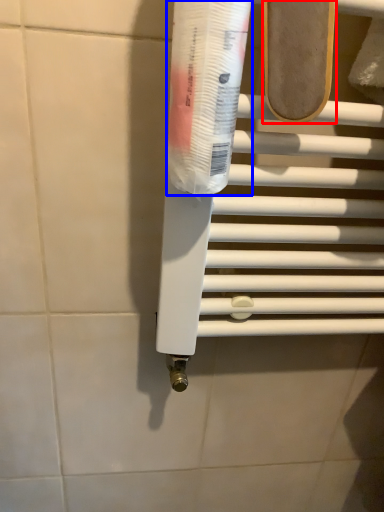
Question: Which of the following is the farthest to the observer, footwear (highlighted by a red box) or toothpaste (highlighted by a blue box)?

Choices:
 (A) footwear
 (B) toothpaste

Answer: (A)